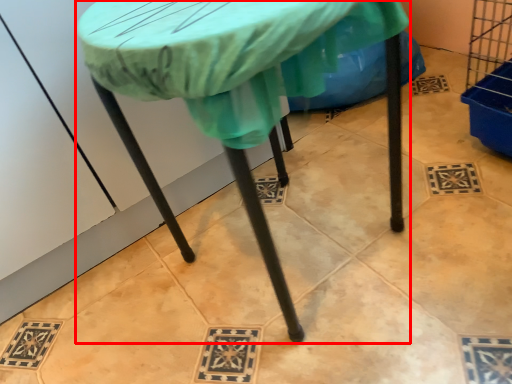
Question: Where is table (annotated by the red box) located in relation to fabric in the image?

Choices:
 (A) right
 (B) left

Answer: (B)